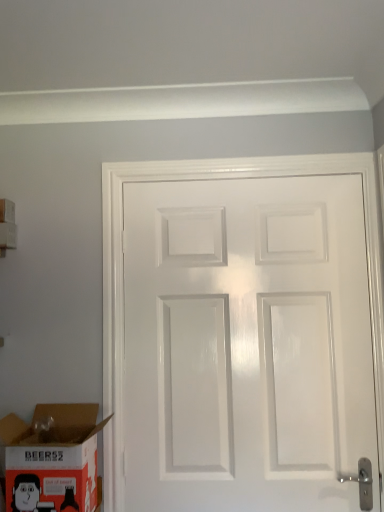
What do you see at coordinates (51, 459) in the screenshot? This screenshot has width=384, height=512. I see `cardboard box at lower left, which is the 1th box from front to back` at bounding box center [51, 459].

Image resolution: width=384 pixels, height=512 pixels. Find the location of `white cardboard box at upper left, the 2th box when ordered from bottom to top`. white cardboard box at upper left, the 2th box when ordered from bottom to top is located at coordinates (7, 211).

I want to click on white glossy door at center, so click(x=246, y=344).

Is cardboard box at lower left, which is the 1th box from front to back, next to white glossy door at center?

cardboard box at lower left, which is the 1th box from front to back, and white glossy door at center are clearly separated.

Would you say cardboard box at lower left, which is the 1th box from front to back, is inside or outside white glossy door at center?

cardboard box at lower left, which is the 1th box from front to back, is located beyond the bounds of white glossy door at center.

Considering the positions of points (78, 412) and (314, 467), is point (78, 412) farther from camera compared to point (314, 467)?

Yes, point (78, 412) is farther from viewer.

Does cardboard box at lower left, marked as the second box in a back-to-front arrangement, lie behind white glossy door at center?

No, the depth of cardboard box at lower left, marked as the second box in a back-to-front arrangement, is less than that of white glossy door at center.

Looking at the image, does cardboard box at lower left, which is the second box in top-to-bottom order, seem bigger or smaller compared to white cardboard box at upper left, which is the second box in front-to-back order?

Clearly, cardboard box at lower left, which is the second box in top-to-bottom order, is larger in size than white cardboard box at upper left, which is the second box in front-to-back order.

The image size is (384, 512). Find the location of `box lying in front of the white cardboard box at upper left, marked as the first box in a top-to-bottom arrangement`. box lying in front of the white cardboard box at upper left, marked as the first box in a top-to-bottom arrangement is located at coordinates (51, 459).

Considering the sizes of objects cardboard box at lower left, marked as the second box in a back-to-front arrangement, and white cardboard box at upper left, which is the second box in front-to-back order, in the image provided, who is shorter, cardboard box at lower left, marked as the second box in a back-to-front arrangement, or white cardboard box at upper left, which is the second box in front-to-back order,?

Standing shorter between the two is white cardboard box at upper left, which is the second box in front-to-back order.

From the image's perspective, which one is positioned higher, white glossy door at center or white cardboard box at upper left, the second box in the right-to-left sequence?

white cardboard box at upper left, the second box in the right-to-left sequence.

Does point (293, 254) lie behind point (5, 202)?

No.

Does white glossy door at center have a smaller size compared to white cardboard box at upper left, which is the 1th box in back-to-front order?

No.

Does white glossy door at center appear on the right side of white cardboard box at upper left, marked as the first box in a top-to-bottom arrangement?

Yes, white glossy door at center is to the right of white cardboard box at upper left, marked as the first box in a top-to-bottom arrangement.

Which is more to the right, white cardboard box at upper left, the 2th box when ordered from bottom to top, or white glossy door at center?

white glossy door at center.

Could you tell me if white cardboard box at upper left, the 2th box when ordered from bottom to top, is turned towards white glossy door at center?

Yes.

Which of these two, white cardboard box at upper left, which is the 1th box in back-to-front order, or white glossy door at center, is thinner?

white glossy door at center is thinner.

In the scene shown: Considering the relative sizes of white cardboard box at upper left, which is the second box in front-to-back order, and white glossy door at center in the image provided, is white cardboard box at upper left, which is the second box in front-to-back order, shorter than white glossy door at center?

Yes, white cardboard box at upper left, which is the second box in front-to-back order, is shorter than white glossy door at center.

Is the position of white cardboard box at upper left, the 2th box when ordered from bottom to top, less distant than that of cardboard box at lower left, positioned as the 2th box in left-to-right order?

No, it is not.

From the image's perspective, is white cardboard box at upper left, the 2th box when ordered from bottom to top, on cardboard box at lower left, positioned as the 2th box in left-to-right order?

Yes, from the image's perspective, white cardboard box at upper left, the 2th box when ordered from bottom to top, is above cardboard box at lower left, positioned as the 2th box in left-to-right order.

Between white cardboard box at upper left, positioned as the first box in left-to-right order, and cardboard box at lower left, marked as the 1th box in a right-to-left arrangement, which one has larger size?

Bigger between the two is cardboard box at lower left, marked as the 1th box in a right-to-left arrangement.

Is white glossy door at center not close to cardboard box at lower left, positioned as the 2th box in left-to-right order?

white glossy door at center is actually quite close to cardboard box at lower left, positioned as the 2th box in left-to-right order.

Can you confirm if white glossy door at center is wider than cardboard box at lower left, marked as the second box in a back-to-front arrangement?

In fact, white glossy door at center might be narrower than cardboard box at lower left, marked as the second box in a back-to-front arrangement.

Which object is further away from the camera taking this photo, white glossy door at center or cardboard box at lower left, positioned as the 2th box in left-to-right order?

white glossy door at center is further from the camera.

Is cardboard box at lower left, which is the 1th box from front to back, completely or partially inside white glossy door at center?

No, cardboard box at lower left, which is the 1th box from front to back, is not inside white glossy door at center.

Identify the location of door positioned vertically above the cardboard box at lower left, positioned as the 2th box in left-to-right order (from a real-world perspective). (246, 344).

You are a GUI agent. You are given a task and a screenshot of the screen. Output one action in this format:
    pyautogui.click(x=<x>, y=<y>)
    Task: Click on the box located on the left of cardboard box at lower left, which is the 1th box from front to back
    Image resolution: width=384 pixels, height=512 pixels.
    Given the screenshot: What is the action you would take?
    (x=7, y=211)

Estimate the real-world distances between objects in this image. Which object is further from white cardboard box at upper left, the second box in the right-to-left sequence, cardboard box at lower left, marked as the second box in a back-to-front arrangement, or white glossy door at center?

white glossy door at center lies further to white cardboard box at upper left, the second box in the right-to-left sequence, than the other object.

Looking at this image, which object lies further to the anchor point cardboard box at lower left, positioned as the 2th box in left-to-right order, white cardboard box at upper left, which is the second box in front-to-back order, or white glossy door at center?

white cardboard box at upper left, which is the second box in front-to-back order.

Based on their spatial positions, is cardboard box at lower left, marked as the second box in a back-to-front arrangement, or white cardboard box at upper left, marked as the first box in a top-to-bottom arrangement, closer to white glossy door at center?

Based on the image, cardboard box at lower left, marked as the second box in a back-to-front arrangement, appears to be nearer to white glossy door at center.

When comparing their distances from white cardboard box at upper left, the second box in the right-to-left sequence, does white glossy door at center or cardboard box at lower left, the 1th box when ordered from bottom to top, seem further?

Based on the image, white glossy door at center appears to be further to white cardboard box at upper left, the second box in the right-to-left sequence.

Which object lies nearer to the anchor point white glossy door at center, white cardboard box at upper left, the 2th box when ordered from bottom to top, or cardboard box at lower left, marked as the 1th box in a right-to-left arrangement?

cardboard box at lower left, marked as the 1th box in a right-to-left arrangement.

When comparing their distances from cardboard box at lower left, marked as the second box in a back-to-front arrangement, does white glossy door at center or white cardboard box at upper left, the 2th box when ordered from bottom to top, seem closer?

white glossy door at center.

What are the coordinates of `box between white cardboard box at upper left, marked as the first box in a top-to-bottom arrangement, and white glossy door at center, in the horizontal direction` in the screenshot? It's located at (51, 459).